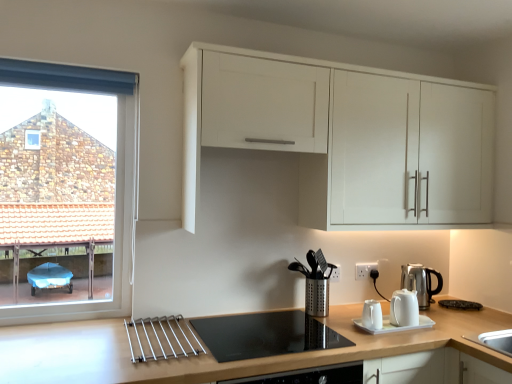
Where is `free space in front of white glossy teapot at center, which is the 2th kitchen appliance in back-to-front order`? Image resolution: width=512 pixels, height=384 pixels. free space in front of white glossy teapot at center, which is the 2th kitchen appliance in back-to-front order is located at coordinates (385, 334).